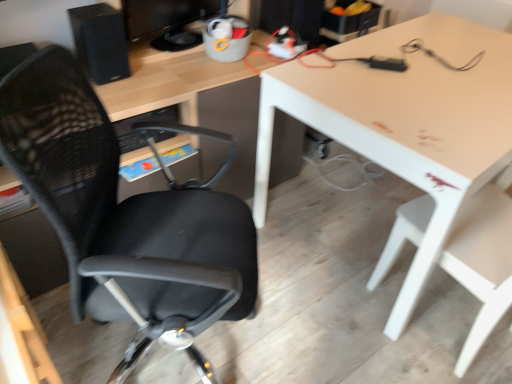
Question: Is matte black monitor at upper center aimed at black matte speaker at upper left?

Choices:
 (A) yes
 (B) no

Answer: (B)

Question: Considering the relative sizes of matte black monitor at upper center and black matte speaker at upper left in the image provided, is matte black monitor at upper center smaller than black matte speaker at upper left?

Choices:
 (A) no
 (B) yes

Answer: (A)

Question: Does matte black monitor at upper center have a lesser height compared to black matte speaker at upper left?

Choices:
 (A) yes
 (B) no

Answer: (B)

Question: Does matte black monitor at upper center lie in front of black matte speaker at upper left?

Choices:
 (A) no
 (B) yes

Answer: (A)

Question: Is matte black monitor at upper center next to black matte speaker at upper left?

Choices:
 (A) no
 (B) yes

Answer: (A)

Question: Is matte black monitor at upper center oriented away from black matte speaker at upper left?

Choices:
 (A) yes
 (B) no

Answer: (B)

Question: Considering the relative positions of white glossy table at upper right and black matte speaker at upper left in the image provided, is white glossy table at upper right to the left of black matte speaker at upper left from the viewer's perspective?

Choices:
 (A) yes
 (B) no

Answer: (B)

Question: Is white glossy table at upper right outside of black matte speaker at upper left?

Choices:
 (A) no
 (B) yes

Answer: (B)

Question: Is white glossy table at upper right oriented towards black matte speaker at upper left?

Choices:
 (A) no
 (B) yes

Answer: (A)

Question: Are white glossy table at upper right and black matte speaker at upper left far apart?

Choices:
 (A) no
 (B) yes

Answer: (A)

Question: Does white glossy table at upper right have a lesser height compared to black matte speaker at upper left?

Choices:
 (A) yes
 (B) no

Answer: (B)

Question: Can you confirm if white glossy table at upper right is taller than black matte speaker at upper left?

Choices:
 (A) yes
 (B) no

Answer: (A)

Question: Is the position of black mesh office chair at left, the 2th chair when ordered from right to left, more distant than that of matte black monitor at upper center?

Choices:
 (A) no
 (B) yes

Answer: (A)